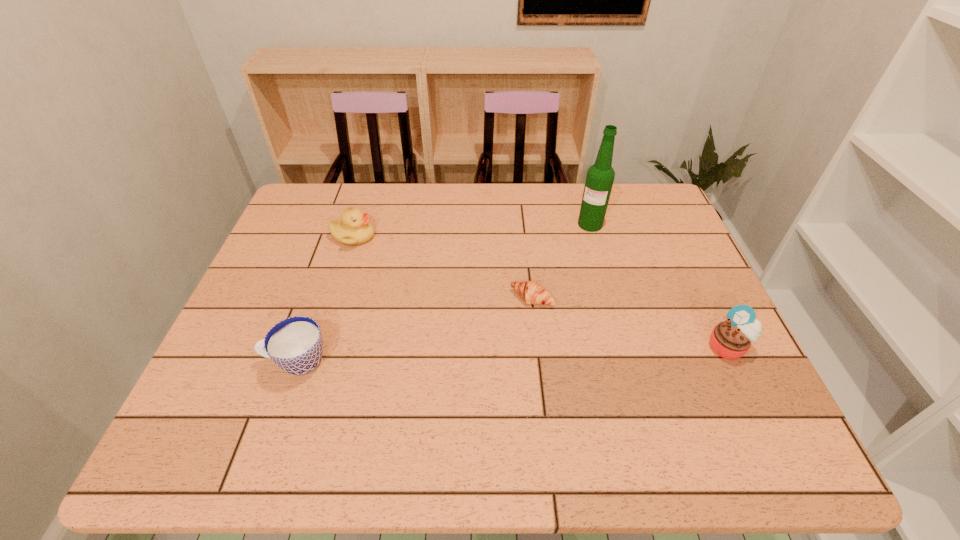
Image resolution: width=960 pixels, height=540 pixels. In order to click on beer bottle that is at the far edge in this screenshot , I will do [600, 176].

At what (x,y) coordinates should I click in order to perform the action: click on duckling present at the far edge. Please return your answer as a coordinate pair (x, y). Looking at the image, I should click on (355, 228).

Locate an element on the screen. object present at the near edge is located at coordinates (295, 344).

Image resolution: width=960 pixels, height=540 pixels. What are the coordinates of `cup at the left edge` in the screenshot? It's located at (295, 344).

At what (x,y) coordinates should I click in order to perform the action: click on duckling that is positioned at the left edge. Please return your answer as a coordinate pair (x, y). Image resolution: width=960 pixels, height=540 pixels. Looking at the image, I should click on (355, 228).

Locate an element on the screen. object located in the right edge section of the desktop is located at coordinates (731, 339).

I want to click on object that is at the far left corner, so click(355, 228).

At what (x,y) coordinates should I click in order to perform the action: click on object situated at the near left corner. Please return your answer as a coordinate pair (x, y). Looking at the image, I should click on (295, 344).

The image size is (960, 540). I want to click on free space at the far edge of the desktop, so click(448, 194).

In the image, there is a desktop. At what (x,y) coordinates should I click in order to perform the action: click on free space at the near edge. Please return your answer as a coordinate pair (x, y). Looking at the image, I should click on (493, 409).